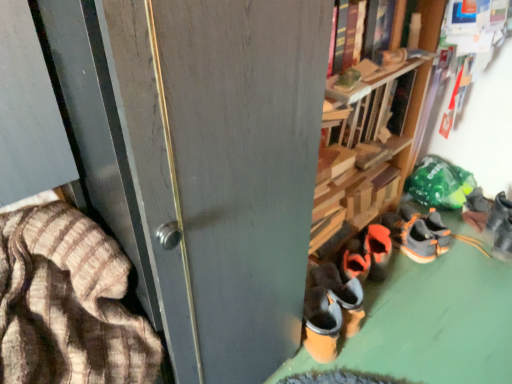
Question: Is orange suede shoes at center, the fourth footwear viewed from the right, thinner than orange suede sneaker at lower right, which is the second footwear from right to left?

Choices:
 (A) no
 (B) yes

Answer: (A)

Question: From the image's perspective, is orange suede shoes at center, the fourth footwear viewed from the right, below orange suede sneaker at lower right, which is the second footwear from right to left?

Choices:
 (A) yes
 (B) no

Answer: (A)

Question: From the image's perspective, is orange suede shoes at center, which ranks as the second footwear in left-to-right order, located above orange suede sneaker at lower right, which is counted as the fourth footwear, starting from the left?

Choices:
 (A) no
 (B) yes

Answer: (A)

Question: Does orange suede shoes at center, the fourth footwear viewed from the right, have a greater width compared to orange suede sneaker at lower right, which is the second footwear from right to left?

Choices:
 (A) no
 (B) yes

Answer: (B)

Question: Considering the relative sizes of orange suede shoes at center, which ranks as the second footwear in left-to-right order, and orange suede sneaker at lower right, which is the second footwear from right to left, in the image provided, is orange suede shoes at center, which ranks as the second footwear in left-to-right order, shorter than orange suede sneaker at lower right, which is the second footwear from right to left,?

Choices:
 (A) no
 (B) yes

Answer: (B)

Question: Can you confirm if orange suede shoes at center, the fourth footwear viewed from the right, is bigger than orange suede sneaker at lower right, which is counted as the fourth footwear, starting from the left?

Choices:
 (A) no
 (B) yes

Answer: (B)

Question: Is brown striped fabric at left a part of gray suede sneakers at lower right, which appears as the first footwear when viewed from the right?

Choices:
 (A) no
 (B) yes

Answer: (A)

Question: Is gray suede sneakers at lower right, the 5th footwear when ordered from left to right, smaller than brown striped fabric at left?

Choices:
 (A) yes
 (B) no

Answer: (A)

Question: Does gray suede sneakers at lower right, which appears as the first footwear when viewed from the right, have a larger size compared to brown striped fabric at left?

Choices:
 (A) yes
 (B) no

Answer: (B)

Question: Can you see gray suede sneakers at lower right, which appears as the first footwear when viewed from the right, touching brown striped fabric at left?

Choices:
 (A) no
 (B) yes

Answer: (A)

Question: Considering the relative sizes of gray suede sneakers at lower right, the 5th footwear when ordered from left to right, and brown striped fabric at left in the image provided, is gray suede sneakers at lower right, the 5th footwear when ordered from left to right, thinner than brown striped fabric at left?

Choices:
 (A) no
 (B) yes

Answer: (B)

Question: Can you confirm if gray suede sneakers at lower right, which appears as the first footwear when viewed from the right, is positioned to the left of brown striped fabric at left?

Choices:
 (A) yes
 (B) no

Answer: (B)

Question: Is matte gray screen door at center bigger than dark brown suede shoes at lower right, which ranks as the 5th footwear in right-to-left order?

Choices:
 (A) no
 (B) yes

Answer: (B)